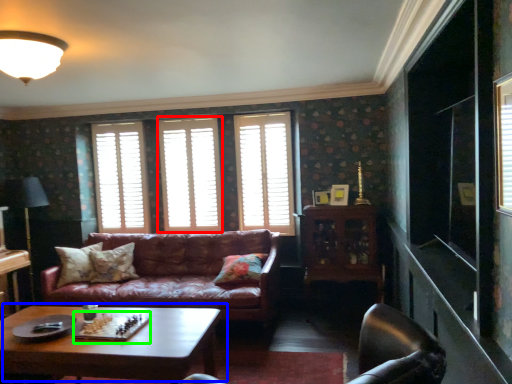
Question: Which object is positioned closest to window (highlighted by a red box)? Select from coffee table (highlighted by a blue box) and board game (highlighted by a green box).

Choices:
 (A) coffee table
 (B) board game

Answer: (A)